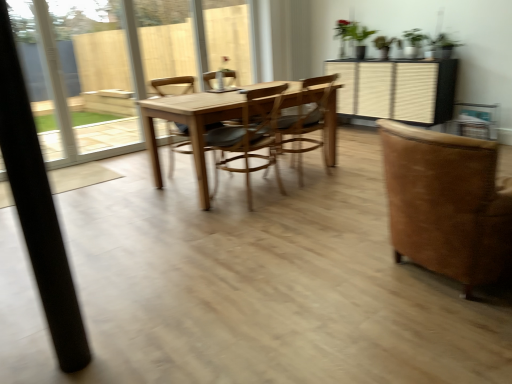
Find the location of a particular element. Image resolution: width=512 pixels, height=384 pixels. free space between brown suede chair at right, which ranks as the first chair in right-to-left order, and black matte pole at left is located at coordinates (282, 312).